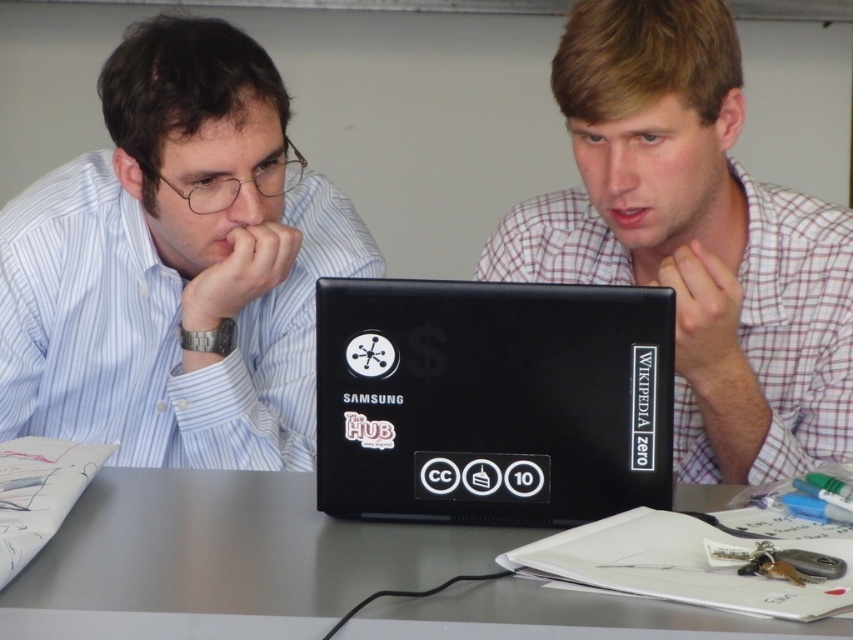
Question: Which of the following is the closest to the observer?

Choices:
 (A) matte black shirt at left
 (B) metallic gray table at center

Answer: (B)

Question: Considering the relative positions of plaid shirt at center and metallic gray table at center in the image provided, where is plaid shirt at center located with respect to metallic gray table at center?

Choices:
 (A) right
 (B) left

Answer: (A)

Question: Does black matte laptop at center have a smaller size compared to metallic gray table at center?

Choices:
 (A) yes
 (B) no

Answer: (A)

Question: Estimate the real-world distances between objects in this image. Which object is closer to the plaid shirt at center?

Choices:
 (A) black matte laptop at center
 (B) matte black shirt at left
 (C) metallic gray table at center

Answer: (A)

Question: Estimate the real-world distances between objects in this image. Which object is farther from the black matte laptop at center?

Choices:
 (A) metallic gray table at center
 (B) matte black shirt at left
 (C) plaid shirt at center

Answer: (B)

Question: Is black matte laptop at center behind metallic gray table at center?

Choices:
 (A) no
 (B) yes

Answer: (B)